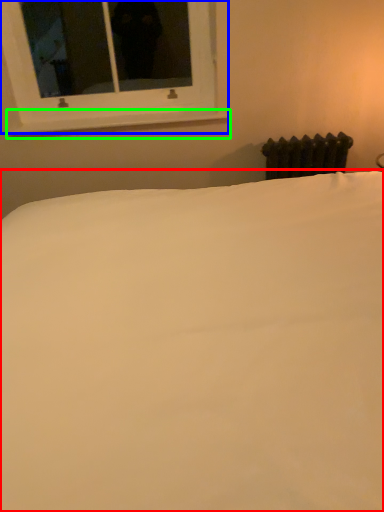
Question: Based on their relative distances, which object is nearer to bed (highlighted by a red box)? Choose from window (highlighted by a blue box) and window sill (highlighted by a green box).

Choices:
 (A) window
 (B) window sill

Answer: (A)